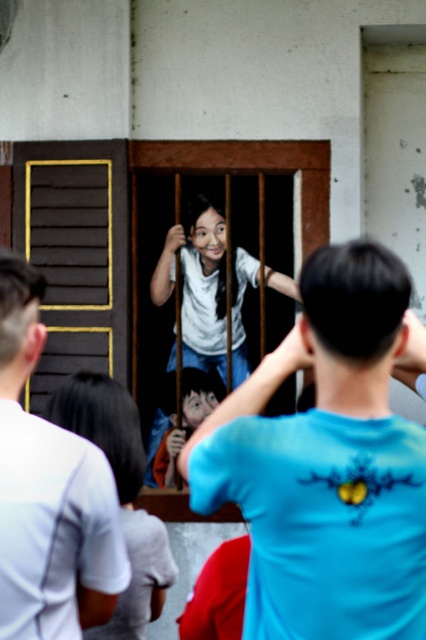
Can you confirm if blue t-shirt at center is positioned to the right of white matte shirt at center?

Yes, blue t-shirt at center is to the right of white matte shirt at center.

The width and height of the screenshot is (426, 640). I want to click on blue t-shirt at center, so coord(327,465).

Which is in front, point (233, 401) or point (210, 284)?

Point (233, 401)

You are a GUI agent. You are given a task and a screenshot of the screen. Output one action in this format:
    pyautogui.click(x=<x>, y=<y>)
    Task: Click on the blue t-shirt at center
    
    Given the screenshot: What is the action you would take?
    pyautogui.click(x=327, y=465)

Does white matte shirt at upper left have a lesser height compared to white matte shirt at center?

Yes, white matte shirt at upper left is shorter than white matte shirt at center.

Is white matte shirt at upper left taller than white matte shirt at center?

Incorrect, white matte shirt at upper left's height is not larger of white matte shirt at center's.

Does point (54, 486) lie in front of point (190, 307)?

That is True.

Locate an element on the screen. The width and height of the screenshot is (426, 640). white matte shirt at upper left is located at coordinates (48, 493).

Is white matte shirt at upper left taller than smooth gray shirt at center?

Indeed, white matte shirt at upper left has a greater height compared to smooth gray shirt at center.

Looking at this image, is white matte shirt at upper left smaller than smooth gray shirt at center?

Yes, white matte shirt at upper left is smaller than smooth gray shirt at center.

This screenshot has height=640, width=426. Describe the element at coordinates (48, 493) in the screenshot. I see `white matte shirt at upper left` at that location.

Find the location of a particular element. Image resolution: width=426 pixels, height=640 pixels. white matte shirt at upper left is located at coordinates (48, 493).